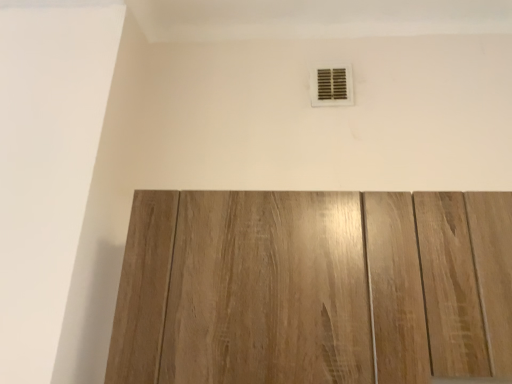
I want to click on light brown wood door at center, so click(314, 288).

What do you see at coordinates (314, 288) in the screenshot? This screenshot has width=512, height=384. I see `light brown wood door at center` at bounding box center [314, 288].

At what (x,y) coordinates should I click in order to perform the action: click on matte plastic vent at upper center. Please return your answer as a coordinate pair (x, y). Looking at the image, I should click on (331, 85).

Describe the element at coordinates (331, 85) in the screenshot. The width and height of the screenshot is (512, 384). I see `matte plastic vent at upper center` at that location.

What is the approximate width of matte plastic vent at upper center?

It is 0.78 inches.

From the picture: What is the approximate height of matte plastic vent at upper center?

It is 18.06 centimeters.

In order to face matte plastic vent at upper center, should I rotate leftwards or rightwards?

A 10.242 degree turn to the right will do.

At what (x,y) coordinates should I click in order to perform the action: click on light brown wood door at center. Please return your answer as a coordinate pair (x, y). Image resolution: width=512 pixels, height=384 pixels. Looking at the image, I should click on (314, 288).

Consider the image. Which object is positioned more to the left, light brown wood door at center or matte plastic vent at upper center?

Positioned to the left is light brown wood door at center.

Is light brown wood door at center in front of or behind matte plastic vent at upper center in the image?

Visually, light brown wood door at center is located in front of matte plastic vent at upper center.

Does point (258, 241) appear closer or farther from the camera than point (329, 78)?

Point (258, 241) appears to be closer to the viewer than point (329, 78).

From the image's perspective, is light brown wood door at center on top of matte plastic vent at upper center?

Incorrect, from the image's perspective, light brown wood door at center is lower than matte plastic vent at upper center.

From a real-world perspective, which is physically below, light brown wood door at center or matte plastic vent at upper center?

From a 3D spatial view, light brown wood door at center is below.

Considering the relative sizes of light brown wood door at center and matte plastic vent at upper center in the image provided, is light brown wood door at center thinner than matte plastic vent at upper center?

No, light brown wood door at center is not thinner than matte plastic vent at upper center.

Between light brown wood door at center and matte plastic vent at upper center, which one has more height?

With more height is light brown wood door at center.

Considering the relative sizes of light brown wood door at center and matte plastic vent at upper center in the image provided, is light brown wood door at center smaller than matte plastic vent at upper center?

No.

From the picture: Is matte plastic vent at upper center completely or partially inside light brown wood door at center?

Definitely not — matte plastic vent at upper center is not inside light brown wood door at center.

Would you say light brown wood door at center is a long distance from matte plastic vent at upper center?

No, light brown wood door at center is not far from matte plastic vent at upper center.

Is light brown wood door at center positioned with its back to matte plastic vent at upper center?

light brown wood door at center is not turned away from matte plastic vent at upper center.

Can you tell me how much light brown wood door at center and matte plastic vent at upper center differ in facing direction?

1.7 degrees separate the facing orientations of light brown wood door at center and matte plastic vent at upper center.

You are a GUI agent. You are given a task and a screenshot of the screen. Output one action in this format:
    pyautogui.click(x=<x>, y=<y>)
    Task: Click on the air conditioning lying above the light brown wood door at center (from the image's perspective)
    The image size is (512, 384).
    Given the screenshot: What is the action you would take?
    pyautogui.click(x=331, y=85)

In the image, is matte plastic vent at upper center on the left side or the right side of light brown wood door at center?

In the image, matte plastic vent at upper center appears on the right side of light brown wood door at center.

Considering the positions of objects matte plastic vent at upper center and light brown wood door at center in the image provided, who is behind, matte plastic vent at upper center or light brown wood door at center?

matte plastic vent at upper center is further away from the camera.

Does point (324, 96) come behind point (146, 293)?

Yes, point (324, 96) is farther from viewer.

From the image's perspective, which is above, matte plastic vent at upper center or light brown wood door at center?

matte plastic vent at upper center, from the image's perspective.

Based on the photo, from a real-world perspective, between matte plastic vent at upper center and light brown wood door at center, who is vertically lower?

light brown wood door at center.

Considering the relative sizes of matte plastic vent at upper center and light brown wood door at center in the image provided, is matte plastic vent at upper center thinner than light brown wood door at center?

Yes.

Does matte plastic vent at upper center have a lesser height compared to light brown wood door at center?

Correct, matte plastic vent at upper center is not as tall as light brown wood door at center.

Which of these two, matte plastic vent at upper center or light brown wood door at center, is bigger?

light brown wood door at center.

Does matte plastic vent at upper center contain light brown wood door at center?

No, matte plastic vent at upper center does not contain light brown wood door at center.

Is matte plastic vent at upper center far from light brown wood door at center?

matte plastic vent at upper center is near light brown wood door at center, not far away.

Could you tell me if matte plastic vent at upper center is facing light brown wood door at center?

No, matte plastic vent at upper center is not oriented towards light brown wood door at center.

How far apart are matte plastic vent at upper center and light brown wood door at center?

28.55 inches.

The image size is (512, 384). I want to click on door in front of the matte plastic vent at upper center, so click(314, 288).

The image size is (512, 384). In order to click on air conditioning lying above the light brown wood door at center (from the image's perspective) in this screenshot , I will do `click(331, 85)`.

The width and height of the screenshot is (512, 384). Identify the location of door that appears on the left of matte plastic vent at upper center. (314, 288).